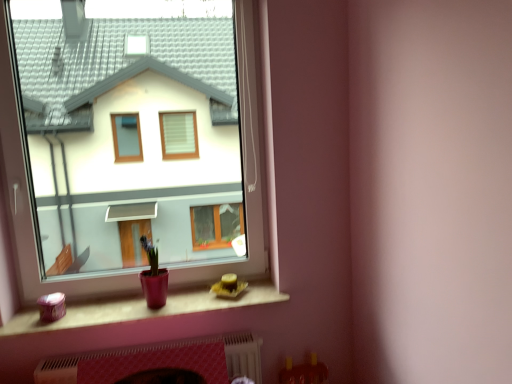
What is the approximate width of matte plastic window sill at lower center?

matte plastic window sill at lower center is 10.24 inches in width.

Identify the location of matte plastic window sill at lower center. (142, 309).

Find the location of a particular element. This screenshot has width=512, height=384. matte glass window at center is located at coordinates (140, 148).

Does point (91, 11) come farther from viewer compared to point (244, 348)?

Yes, point (91, 11) is behind point (244, 348).

Does matte glass window at center have a lesser width compared to white textured fireplace at lower center?

Yes, matte glass window at center is thinner than white textured fireplace at lower center.

Is matte glass window at center located outside white textured fireplace at lower center?

matte glass window at center lies outside white textured fireplace at lower center's area.

Is the position of matte plastic window sill at lower center more distant than that of matte glass window at center?

Yes.

Which is correct: matte plastic window sill at lower center is inside matte glass window at center, or outside of it?

matte plastic window sill at lower center exists outside the volume of matte glass window at center.

Which of these two, matte plastic window sill at lower center or matte glass window at center, stands shorter?

matte plastic window sill at lower center.

Measure the distance between matte plastic window sill at lower center and matte glass window at center.

8.34 feet.

Looking at this image, from a real-world perspective, which is physically above, white textured fireplace at lower center or matte glass window at center?

matte glass window at center, from a real-world perspective.

Considering the relative sizes of white textured fireplace at lower center and matte glass window at center in the image provided, is white textured fireplace at lower center thinner than matte glass window at center?

No, white textured fireplace at lower center is not thinner than matte glass window at center.

Are white textured fireplace at lower center and matte glass window at center making contact?

white textured fireplace at lower center and matte glass window at center are not in contact.

In terms of size, does white textured fireplace at lower center appear bigger or smaller than matte glass window at center?

Considering their sizes, white textured fireplace at lower center takes up less space than matte glass window at center.

Which object is closer to the camera, white textured fireplace at lower center or matte plastic window sill at lower center?

matte plastic window sill at lower center.

How different are the orientations of white textured fireplace at lower center and matte plastic window sill at lower center in degrees?

The angle between the facing direction of white textured fireplace at lower center and the facing direction of matte plastic window sill at lower center is 0.465 degrees.

In terms of height, does white textured fireplace at lower center look taller or shorter compared to matte plastic window sill at lower center?

Clearly, white textured fireplace at lower center is taller compared to matte plastic window sill at lower center.

Can you confirm if matte glass window at center is wider than matte plastic window sill at lower center?

Incorrect, the width of matte glass window at center does not surpass that of matte plastic window sill at lower center.

Does matte glass window at center have a greater height compared to matte plastic window sill at lower center?

Correct, matte glass window at center is much taller as matte plastic window sill at lower center.

Is matte glass window at center in contact with matte plastic window sill at lower center?

matte glass window at center and matte plastic window sill at lower center are not in contact.

From the image's perspective, is matte plastic window sill at lower center located above or below white textured fireplace at lower center?

From the image's perspective, matte plastic window sill at lower center appears above white textured fireplace at lower center.

From a real-world perspective, is matte plastic window sill at lower center under white textured fireplace at lower center?

→ No.

Is white textured fireplace at lower center located within matte plastic window sill at lower center?

No, white textured fireplace at lower center is not surrounded by matte plastic window sill at lower center.

Where is `window above the white textured fireplace at lower center (from a real-world perspective)`? This screenshot has width=512, height=384. window above the white textured fireplace at lower center (from a real-world perspective) is located at coordinates (140, 148).

The width and height of the screenshot is (512, 384). In order to click on window sill behind the matte glass window at center in this screenshot , I will do `click(142, 309)`.

Consider the image. Considering their positions, is white textured fireplace at lower center positioned closer to matte plastic window sill at lower center than matte glass window at center?

The object closer to matte plastic window sill at lower center is white textured fireplace at lower center.

When comparing their distances from white textured fireplace at lower center, does matte glass window at center or matte plastic window sill at lower center seem closer?

matte plastic window sill at lower center.

Which object lies nearer to the anchor point matte glass window at center, white textured fireplace at lower center or matte plastic window sill at lower center?

matte plastic window sill at lower center lies closer to matte glass window at center than the other object.

Estimate the real-world distances between objects in this image. Which object is further from white textured fireplace at lower center, matte plastic window sill at lower center or matte glass window at center?

matte glass window at center is further to white textured fireplace at lower center.

When comparing their distances from matte plastic window sill at lower center, does matte glass window at center or white textured fireplace at lower center seem further?

matte glass window at center.

Estimate the real-world distances between objects in this image. Which object is further from matte glass window at center, matte plastic window sill at lower center or white textured fireplace at lower center?

white textured fireplace at lower center is further to matte glass window at center.

Locate an element on the screen. The height and width of the screenshot is (384, 512). window sill between matte glass window at center and white textured fireplace at lower center from top to bottom is located at coordinates (142, 309).